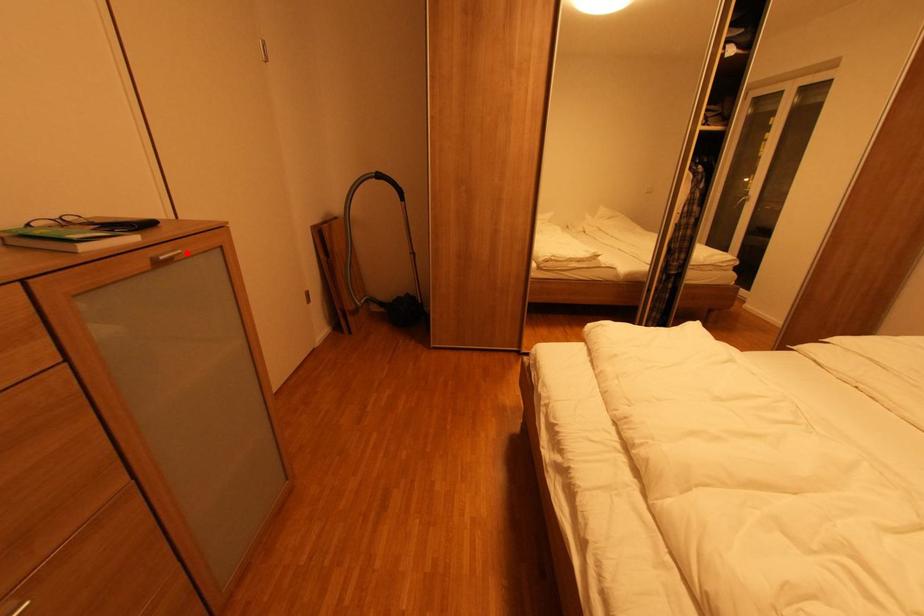
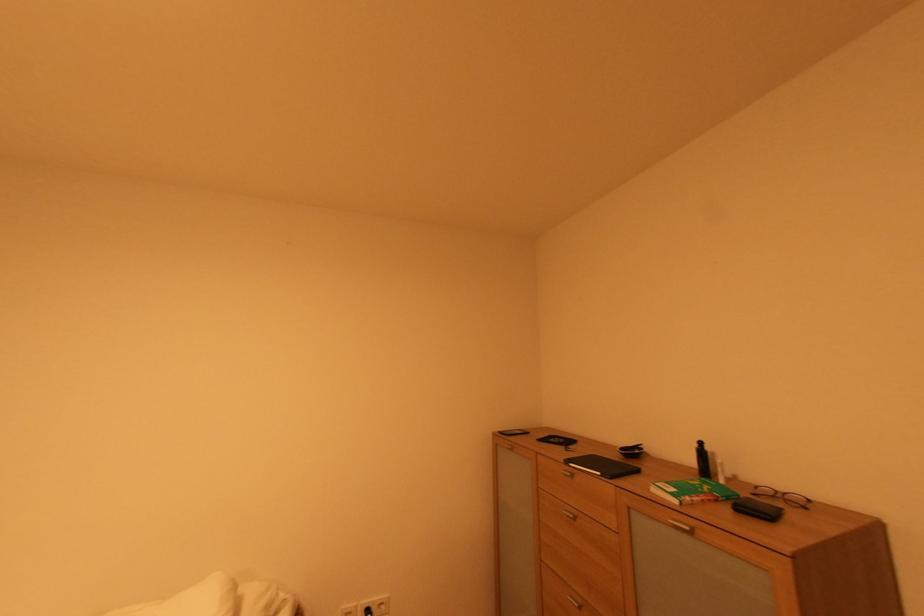
Locate, in the second image, the point that corresponds to the highlighted location in the first image.

(694, 530)